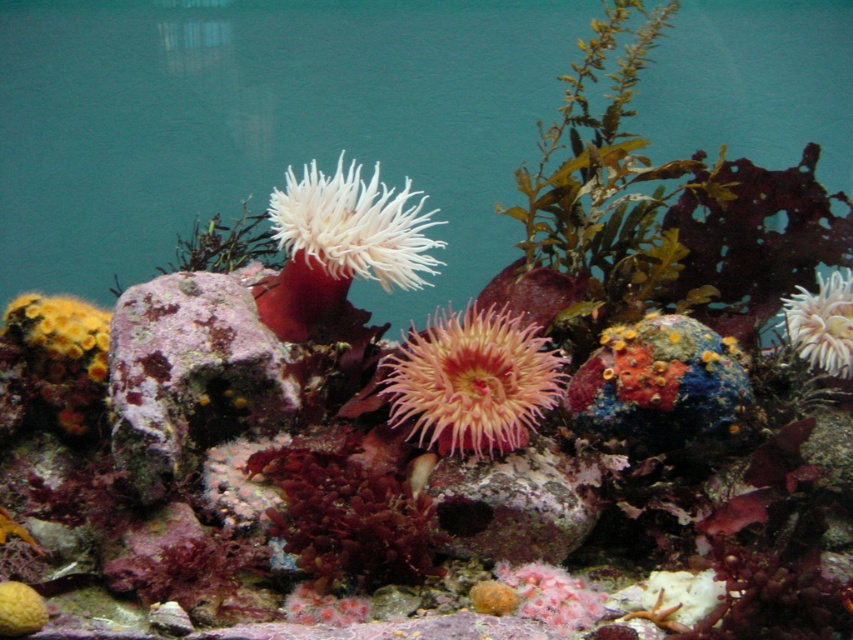
You are an underwater explorer observing the scene. You notice the rusty coral rock at center and the white fluffy anemone at center. Which object is positioned to the left of the other?

The rusty coral rock at center is to the left of the white fluffy anemone at center.